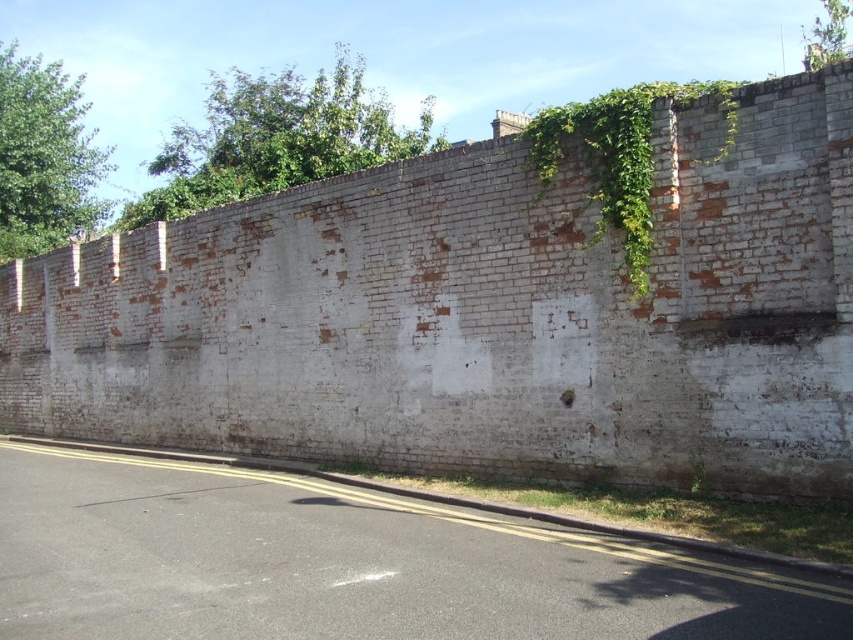
You are standing on the road in front of the wall. There is a point marked at coordinates (44, 156). What is located at that point?

The point at coordinates (44, 156) marks green leafy ivy at upper left.

You are standing on the paved road in front of the weathered brick wall. You see the green leafy ivy at upper center and the green leafy vine at upper right. Which one appears closer to you?

The green leafy ivy at upper center appears closer to you because it is further to the viewer than the green leafy vine at upper right.